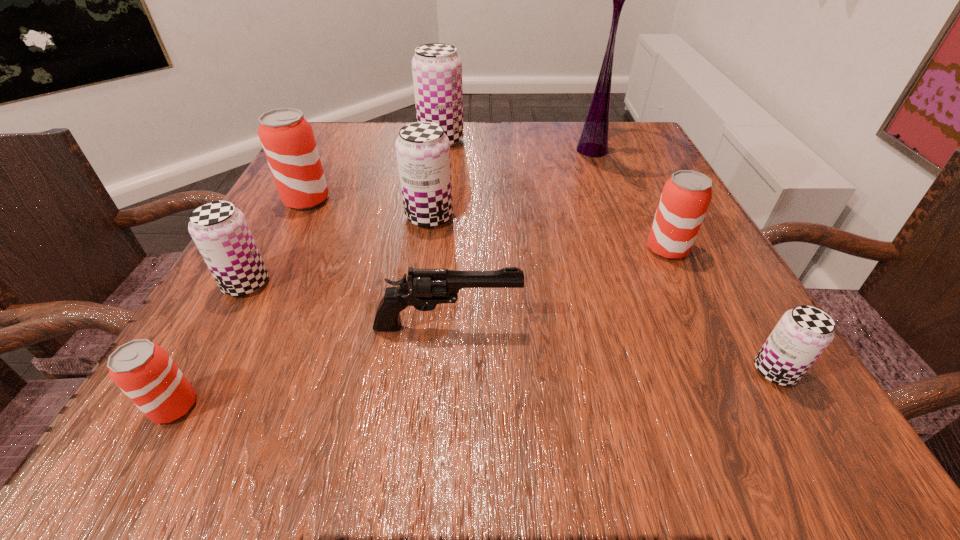
The height and width of the screenshot is (540, 960). What are the coordinates of `vacant space situated 0.160m at the end of the barrel of the black gun` in the screenshot? It's located at (635, 326).

At what (x,y) coordinates should I click in order to perform the action: click on free point located 0.310m on the left of the smallest purple beer can. Please return your answer as a coordinate pair (x, y). Looking at the image, I should click on (510, 371).

I want to click on vacant space located 0.150m on the right of the nearest orange beer can, so click(323, 406).

At what (x,y) coordinates should I click in order to perform the action: click on lampshade located at the far edge. Please return your answer as a coordinate pair (x, y). The width and height of the screenshot is (960, 540). Looking at the image, I should click on (593, 142).

The image size is (960, 540). I want to click on beer can positioned at the far edge, so click(436, 68).

Find the location of a particular element. The image size is (960, 540). lampshade located in the right edge section of the desktop is located at coordinates (593, 142).

You are a GUI agent. You are given a task and a screenshot of the screen. Output one action in this format:
    pyautogui.click(x=<x>, y=<y>)
    Task: Click on the object present at the near left corner
    The height and width of the screenshot is (540, 960).
    Given the screenshot: What is the action you would take?
    pyautogui.click(x=143, y=370)

The width and height of the screenshot is (960, 540). What are the coordinates of `object situated at the far right corner` in the screenshot? It's located at (593, 142).

This screenshot has height=540, width=960. I want to click on object that is at the near right corner, so click(802, 334).

In the image, there is a desktop. At what (x,y) coordinates should I click in order to perform the action: click on vacant space at the far edge. Please return your answer as a coordinate pair (x, y). This screenshot has width=960, height=540. Looking at the image, I should click on (571, 160).